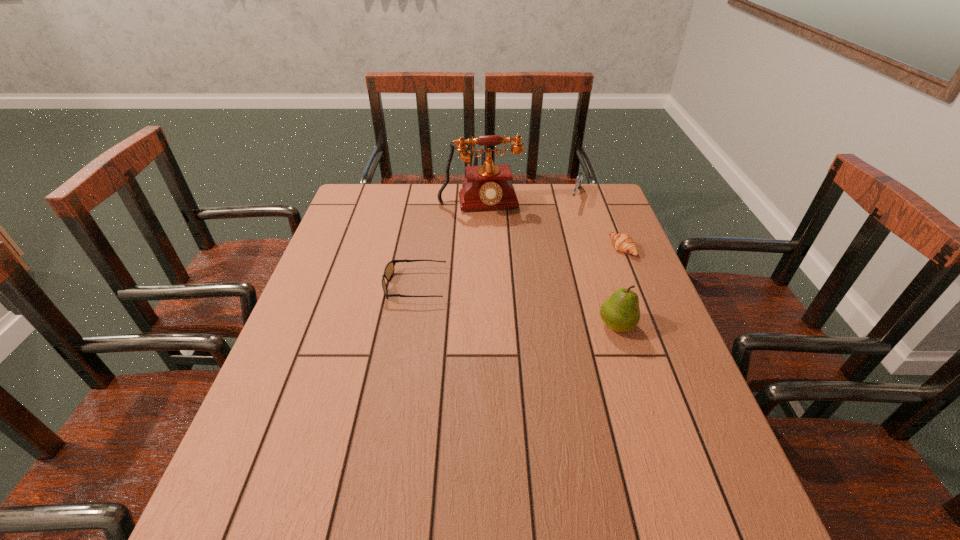
I want to click on vacant space on the desktop that is between the fourth farthest object and the pear and is positioned on the dial of the telephone, so click(x=497, y=302).

You are a GUI agent. You are given a task and a screenshot of the screen. Output one action in this format:
    pyautogui.click(x=<x>, y=<y>)
    Task: Click on the vacant space on the desktop that is between the sunglasses and the fourth shortest object and is positioned on the front-facing side of the third nearest object
    The image size is (960, 540).
    Given the screenshot: What is the action you would take?
    pyautogui.click(x=488, y=300)

Locate an element on the screen. free spot on the desktop that is between the fourth farthest object and the pear and is positioned on the front-facing side of the pistol is located at coordinates (540, 310).